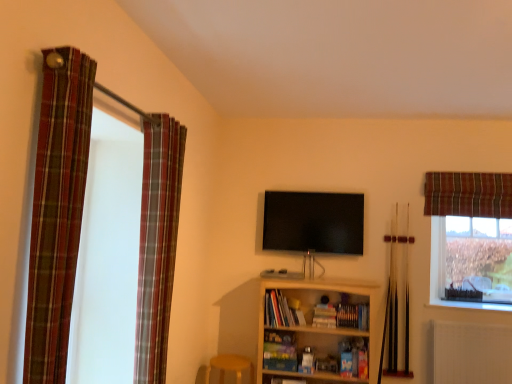
In order to click on free space above white textured radiator at lower right (from a real-world perspective) in this screenshot , I will do `click(461, 316)`.